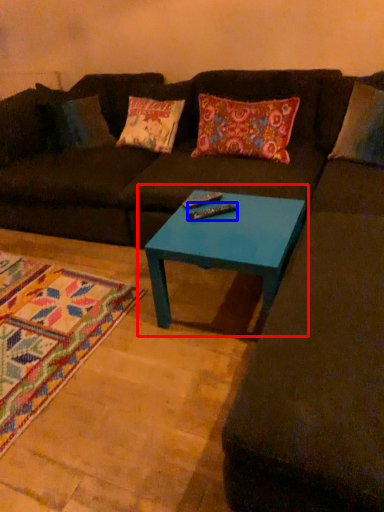
Question: Among these objects, which one is farthest to the camera, coffee table (highlighted by a red box) or remote (highlighted by a blue box)?

Choices:
 (A) coffee table
 (B) remote

Answer: (B)